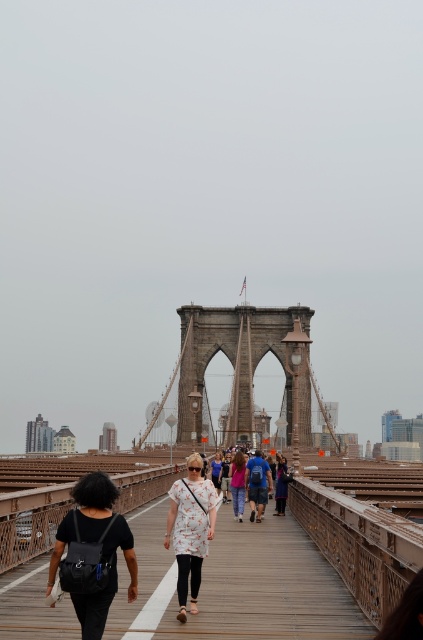
Describe the element at coordinates (236, 586) in the screenshot. The height and width of the screenshot is (640, 423). I see `wooden bridge at center` at that location.

Is wooden bridge at center to the left of floral-patterned dress at center from the viewer's perspective?

Incorrect, wooden bridge at center is not on the left side of floral-patterned dress at center.

Where is `wooden bridge at center`? The image size is (423, 640). wooden bridge at center is located at coordinates 236,586.

Is pink fabric at center positioned behind denim jacket at center?

No, pink fabric at center is closer to the viewer.

Measure the distance between point [230,477] and camera.

Point [230,477] and camera are 192.83 meters apart.

Identify the location of pink fabric at center. (238, 484).

Which is below, stone bridge at center or floral-patterned dress at center?

Positioned lower is floral-patterned dress at center.

Who is higher up, stone bridge at center or floral-patterned dress at center?

stone bridge at center

Where is `stone bridge at center`? Image resolution: width=423 pixels, height=640 pixels. stone bridge at center is located at coordinates (242, 369).

Locate an element on the screen. stone bridge at center is located at coordinates (242, 369).